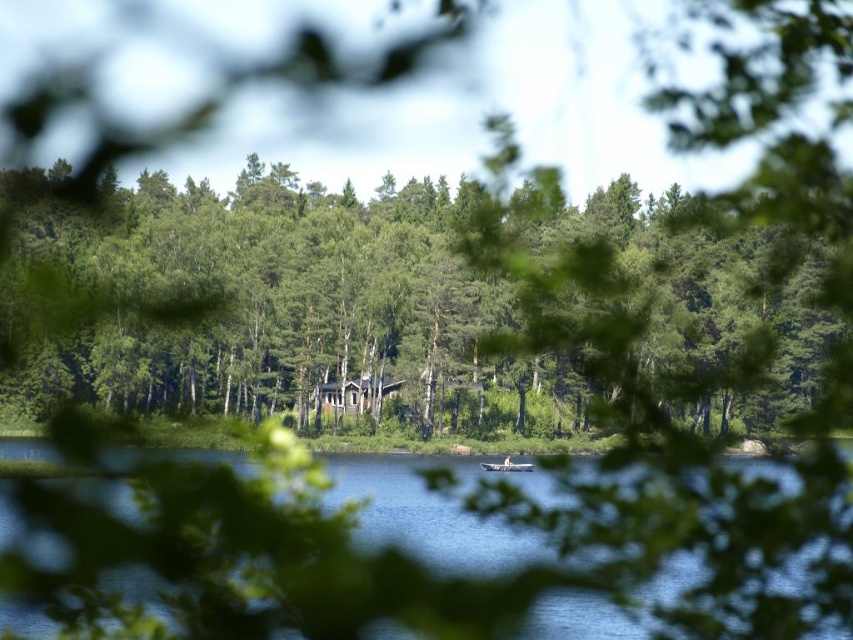
Consider the image. Which is above, green leafy trees at center or wooden boat at center?

green leafy trees at center is higher up.

Which is behind, point (120, 256) or point (521, 464)?

Point (120, 256)

This screenshot has width=853, height=640. In order to click on green leafy trees at center in this screenshot , I will do `click(273, 301)`.

Which is more to the right, green leafy trees at center or blue water at center?

From the viewer's perspective, green leafy trees at center appears more on the right side.

Which is below, green leafy trees at center or blue water at center?

blue water at center

Locate an element on the screen. The image size is (853, 640). green leafy trees at center is located at coordinates (273, 301).

Does point (669, 602) come farther from viewer compared to point (503, 467)?

No, (669, 602) is closer to viewer.

Measure the distance between blue water at center and camera.

The distance of blue water at center from camera is 13.51 meters.

At what (x,y) coordinates should I click in order to perform the action: click on blue water at center. Please return your answer as a coordinate pair (x, y). Image resolution: width=853 pixels, height=640 pixels. Looking at the image, I should click on (436, 513).

At what (x,y) coordinates should I click in order to perform the action: click on blue water at center. Please return your answer as a coordinate pair (x, y). Looking at the image, I should click on click(x=436, y=513).